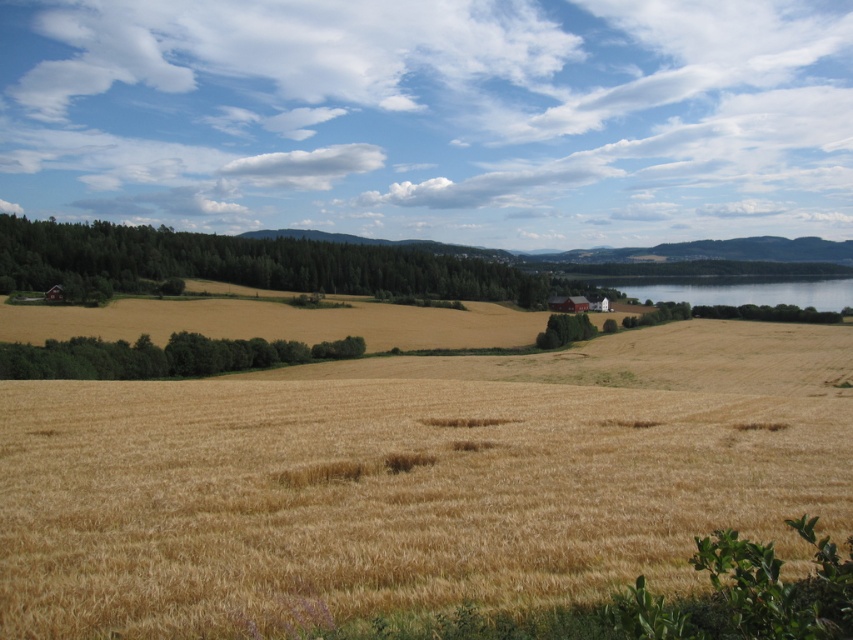
Question: Which of the following is the closest to the observer?

Choices:
 (A) (451, 272)
 (B) (398, 605)

Answer: (B)

Question: Which of these objects is positioned farthest from the green leafy trees at center?

Choices:
 (A) golden wheat field at center
 (B) transparent blue water at right

Answer: (B)

Question: Does green leafy trees at left appear on the right side of green leafy trees at center?

Choices:
 (A) no
 (B) yes

Answer: (A)

Question: Is golden wheat field at center to the left of green leafy trees at left from the viewer's perspective?

Choices:
 (A) no
 (B) yes

Answer: (A)

Question: Can you confirm if golden wheat field at center is smaller than transparent blue water at right?

Choices:
 (A) no
 (B) yes

Answer: (B)

Question: Estimate the real-world distances between objects in this image. Which object is closer to the transparent blue water at right?

Choices:
 (A) green leafy trees at left
 (B) golden wheat field at center

Answer: (A)